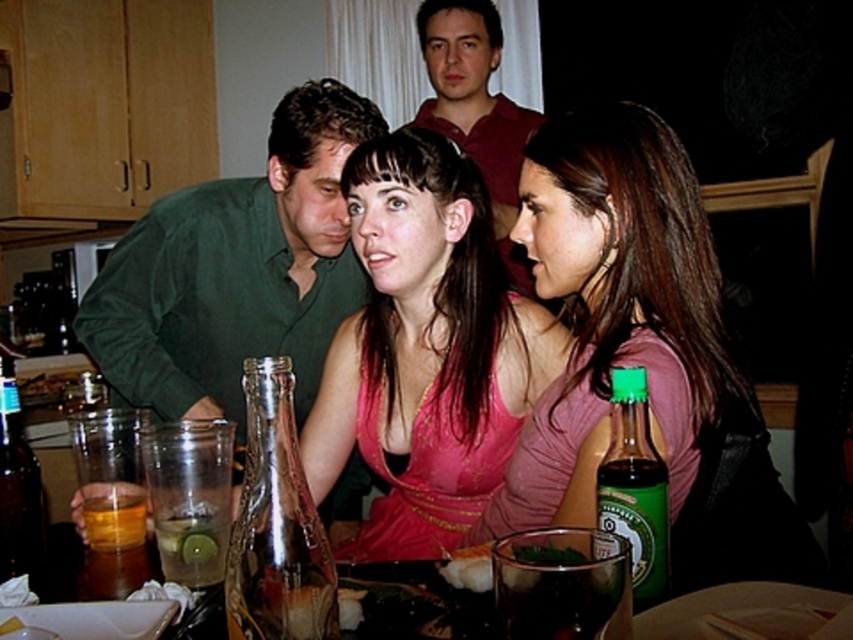
Looking at this image, you are a guest at this party and want to take a photo of the pink fabric dress at center and the amber liquid glass at lower left. To ensure both are in frame, which object should you position closer to the camera?

You should position the amber liquid glass at lower left closer to the camera because the pink fabric dress at center is to the right of it, so moving the glass forward will keep both in frame without one being out of view.